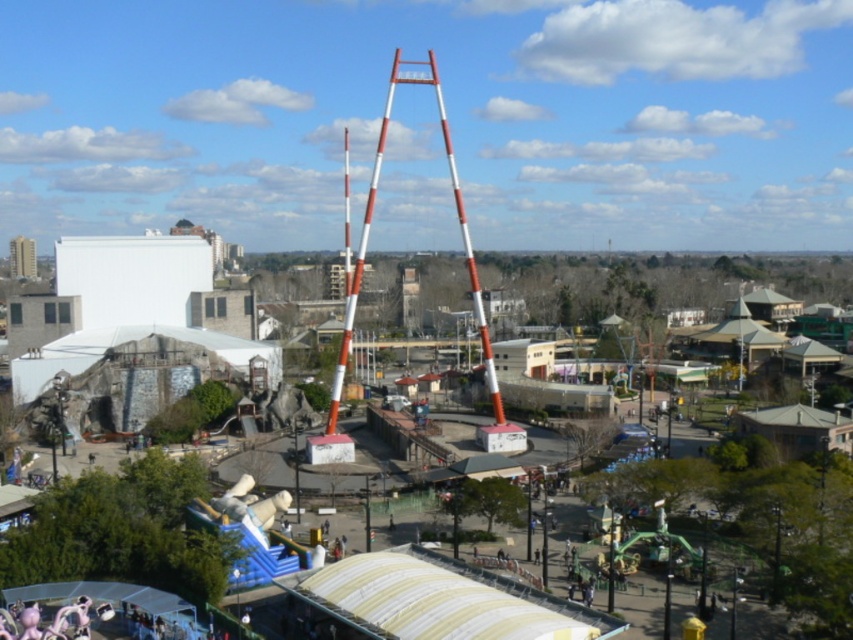
Question: Which point appears closest to the camera in this image?

Choices:
 (A) 386,116
 (B) 345,465

Answer: (B)

Question: Does smooth concrete amusement park at center have a smaller size compared to orange and white striped mast at center?

Choices:
 (A) yes
 (B) no

Answer: (B)

Question: From the image, what is the correct spatial relationship of smooth concrete amusement park at center in relation to orange and white striped mast at center?

Choices:
 (A) above
 (B) below

Answer: (B)

Question: Is smooth concrete amusement park at center thinner than orange and white striped mast at center?

Choices:
 (A) yes
 (B) no

Answer: (B)